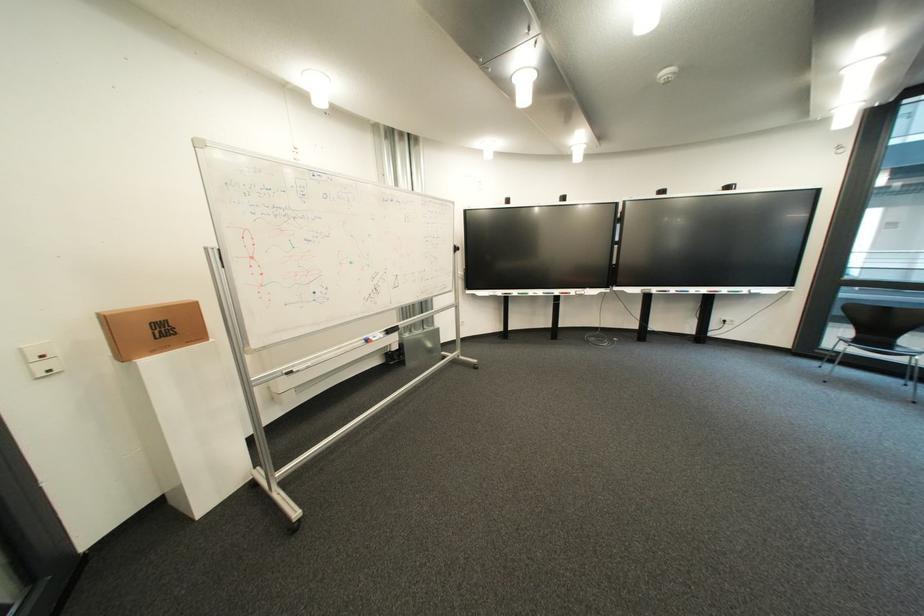
Describe the element at coordinates (725, 322) in the screenshot. I see `the power outlet` at that location.